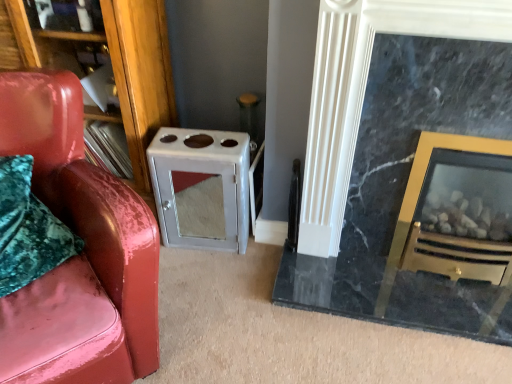
Question: Considering the positions of black marble fireplace at right and satin silver cabinet at center in the image, is black marble fireplace at right taller or shorter than satin silver cabinet at center?

Choices:
 (A) tall
 (B) short

Answer: (A)

Question: Is point pyautogui.click(x=382, y=177) closer or farther from the camera than point pyautogui.click(x=159, y=220)?

Choices:
 (A) closer
 (B) farther

Answer: (A)

Question: Which object is positioned farthest from the black marble fireplace at right?

Choices:
 (A) glossy leather chair at left
 (B) satin silver cabinet at center
 (C) wooden bookshelf at left

Answer: (C)

Question: Which is farther from the satin silver cabinet at center?

Choices:
 (A) wooden bookshelf at left
 (B) black marble fireplace at right
 (C) glossy leather chair at left

Answer: (B)